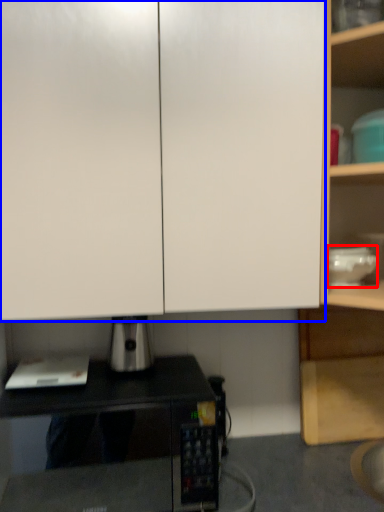
Question: Which object appears farthest to the camera in this image, appliance (highlighted by a red box) or cabinetry (highlighted by a blue box)?

Choices:
 (A) appliance
 (B) cabinetry

Answer: (A)